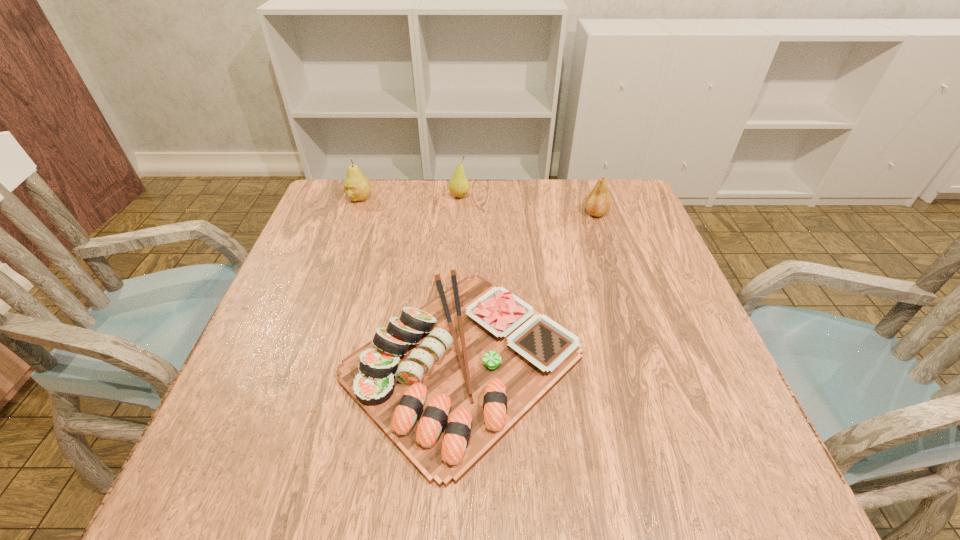
Locate an element on the screen. This screenshot has width=960, height=540. object located at the near edge is located at coordinates (445, 382).

Where is `object that is at the left edge`? Image resolution: width=960 pixels, height=540 pixels. object that is at the left edge is located at coordinates (356, 186).

Find the location of a particular element. Image resolution: width=960 pixels, height=540 pixels. object at the right edge is located at coordinates (598, 202).

This screenshot has height=540, width=960. Identify the location of object present at the far left corner. (356, 186).

Where is `object located at the far right corner`? The height and width of the screenshot is (540, 960). object located at the far right corner is located at coordinates (598, 202).

The image size is (960, 540). I want to click on vacant region at the far edge of the desktop, so click(394, 185).

Where is `free space at the near edge`? The height and width of the screenshot is (540, 960). free space at the near edge is located at coordinates (337, 471).

Find the location of `vacant area at the left edge of the desktop`. vacant area at the left edge of the desktop is located at coordinates (250, 357).

Find the location of a particular element. Image resolution: width=960 pixels, height=540 pixels. vacant space at the right edge is located at coordinates (632, 309).

Find the location of a particular element. The width and height of the screenshot is (960, 540). free space at the far left corner of the desktop is located at coordinates (329, 186).